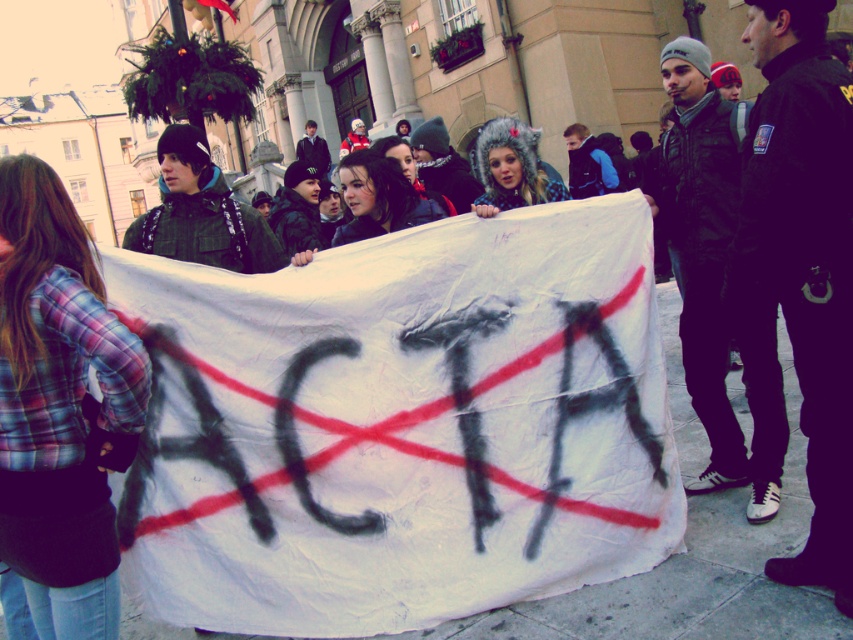
Does plaid fabric shirt at center appear on the left side of fuzzy fur hat at center?

Indeed, plaid fabric shirt at center is positioned on the left side of fuzzy fur hat at center.

Which of these two, plaid fabric shirt at center or fuzzy fur hat at center, stands shorter?

plaid fabric shirt at center is shorter.

Which is in front, point (56, 234) or point (486, 148)?

Point (56, 234) is in front.

Where is `plaid fabric shirt at center`? The width and height of the screenshot is (853, 640). plaid fabric shirt at center is located at coordinates (59, 406).

Between point (358, 230) and point (527, 177), which one is positioned in front?

Point (358, 230) is in front.

Which is above, dark brown hair at center or fuzzy fur hat at center?

fuzzy fur hat at center is higher up.

The width and height of the screenshot is (853, 640). What do you see at coordinates (379, 196) in the screenshot? I see `dark brown hair at center` at bounding box center [379, 196].

Identify the location of dark brown hair at center. This screenshot has width=853, height=640. (379, 196).

Does point (39, 339) come farther from viewer compared to point (364, 189)?

That is False.

Does plaid fabric shirt at center have a larger size compared to dark brown hair at center?

Yes.

Is point (54, 259) positioned after point (358, 221)?

No.

At what (x,y) coordinates should I click in order to perform the action: click on plaid fabric shirt at center. Please return your answer as a coordinate pair (x, y). Image resolution: width=853 pixels, height=640 pixels. Looking at the image, I should click on (59, 406).